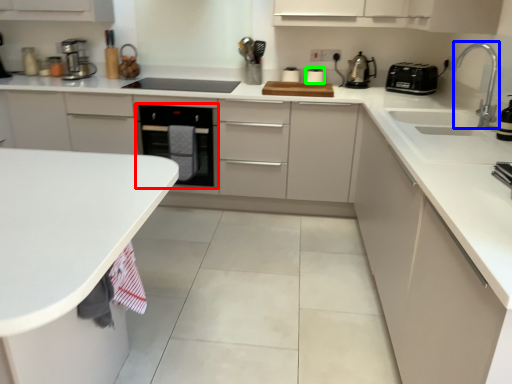
Question: Which object is the farthest from home appliance (highlighted by a red box)? Choose among these: tap (highlighted by a blue box) or appliance (highlighted by a green box).

Choices:
 (A) tap
 (B) appliance

Answer: (A)